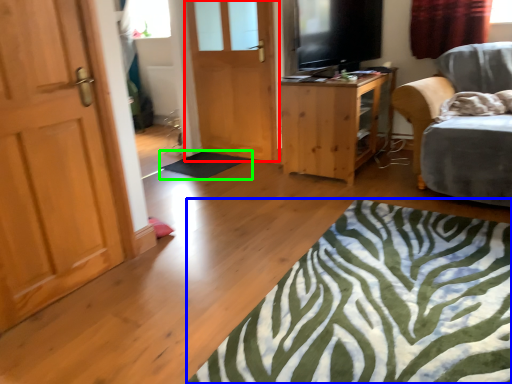
Question: Based on their relative distances, which object is farther from door (highlighted by a red box)? Choose from plain (highlighted by a blue box) and flat (highlighted by a green box).

Choices:
 (A) plain
 (B) flat

Answer: (A)